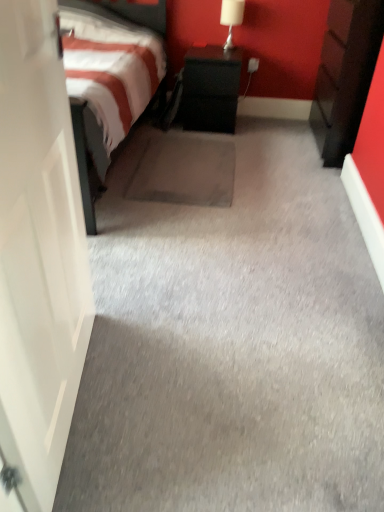
Question: Can we say black matte nightstand at center, the 1th nightstand in the left-to-right sequence, lies outside dark wood nightstand at right, the second nightstand from the left?

Choices:
 (A) no
 (B) yes

Answer: (B)

Question: Is black matte nightstand at center, the 1th nightstand in the left-to-right sequence, not close to dark wood nightstand at right, positioned as the 1th nightstand in right-to-left order?

Choices:
 (A) yes
 (B) no

Answer: (B)

Question: Is black matte nightstand at center, the 1th nightstand in the left-to-right sequence, taller than dark wood nightstand at right, the second nightstand from the left?

Choices:
 (A) no
 (B) yes

Answer: (A)

Question: Considering the relative positions of black matte nightstand at center, the 1th nightstand in the left-to-right sequence, and dark wood nightstand at right, the second nightstand from the left, in the image provided, is black matte nightstand at center, the 1th nightstand in the left-to-right sequence, in front of dark wood nightstand at right, the second nightstand from the left,?

Choices:
 (A) yes
 (B) no

Answer: (B)

Question: Does black matte nightstand at center, the 1th nightstand in the left-to-right sequence, have a greater width compared to dark wood nightstand at right, the second nightstand from the left?

Choices:
 (A) no
 (B) yes

Answer: (B)

Question: Is black matte nightstand at center, the 1th nightstand in the left-to-right sequence, taller or shorter than white glossy table lamp at upper right?

Choices:
 (A) short
 (B) tall

Answer: (B)

Question: Is point (231, 67) positioned closer to the camera than point (226, 37)?

Choices:
 (A) farther
 (B) closer

Answer: (B)

Question: Is black matte nightstand at center, the 1th nightstand in the left-to-right sequence, inside the boundaries of white glossy table lamp at upper right, or outside?

Choices:
 (A) outside
 (B) inside

Answer: (A)

Question: In the image, is black matte nightstand at center, the 1th nightstand in the left-to-right sequence, on the left side or the right side of white glossy table lamp at upper right?

Choices:
 (A) left
 (B) right

Answer: (A)

Question: Is white glossy table lamp at upper right to the left or to the right of dark wood nightstand at right, the second nightstand from the left, in the image?

Choices:
 (A) left
 (B) right

Answer: (A)

Question: Is white glossy table lamp at upper right wider or thinner than dark wood nightstand at right, positioned as the 1th nightstand in right-to-left order?

Choices:
 (A) thin
 (B) wide

Answer: (A)

Question: Does point (236, 19) appear closer or farther from the camera than point (339, 1)?

Choices:
 (A) closer
 (B) farther

Answer: (B)

Question: Based on their sizes in the image, would you say white glossy table lamp at upper right is bigger or smaller than dark wood nightstand at right, the second nightstand from the left?

Choices:
 (A) big
 (B) small

Answer: (B)

Question: Considering the positions of white glossy table lamp at upper right and black matte nightstand at center, the second nightstand in the right-to-left sequence, in the image, is white glossy table lamp at upper right bigger or smaller than black matte nightstand at center, the second nightstand in the right-to-left sequence,?

Choices:
 (A) big
 (B) small

Answer: (B)

Question: Is white glossy table lamp at upper right wider or thinner than black matte nightstand at center, the 1th nightstand in the left-to-right sequence?

Choices:
 (A) thin
 (B) wide

Answer: (A)